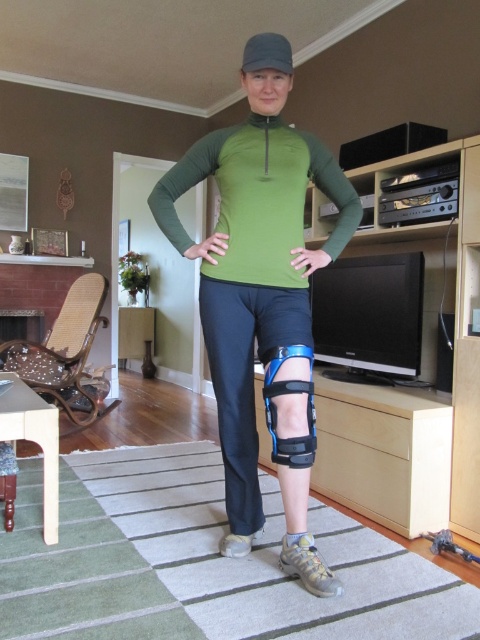
You are a physical therapist assessing a patient who has two knee supports available. The patient needs to choose between the green matte knee brace at center and the blue plastic knee pad at center. Based on their sizes, which one should they select if they require a wider support for better stability?

The green matte knee brace at center might be wider than blue plastic knee pad at center, so the patient should choose the green matte knee brace at center for better stability due to its wider size.

You are a physical therapist examining a patient in the living room. You notice the green matte knee brace at center and the matte gray shoe at lower center. Which object is positioned to the left of the other?

The green matte knee brace at center is positioned to the left of the matte gray shoe at lower center.